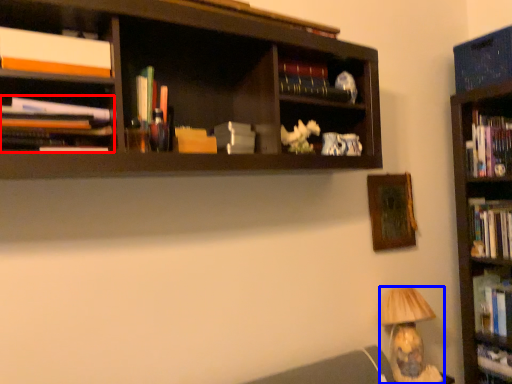
Question: Which point is further to the camera, book (highlighted by a red box) or lamp (highlighted by a blue box)?

Choices:
 (A) book
 (B) lamp

Answer: (B)